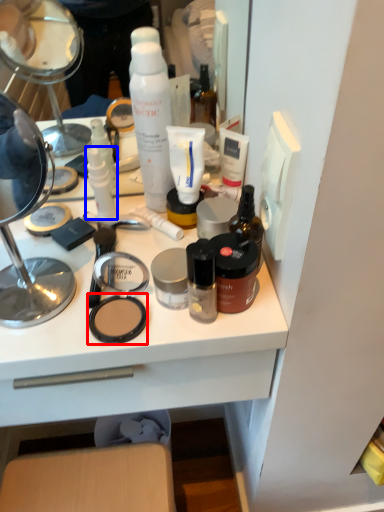
Question: Which point is further to the camera, face powder (highlighted by a red box) or toiletry (highlighted by a blue box)?

Choices:
 (A) face powder
 (B) toiletry

Answer: (B)